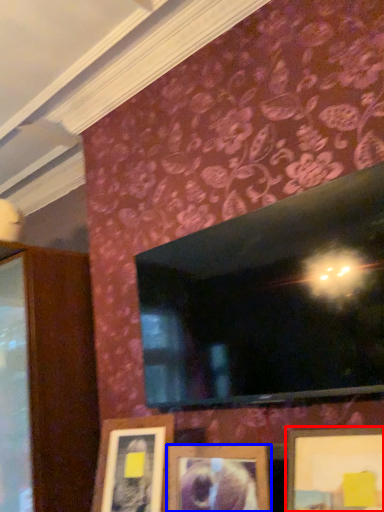
Question: Which object appears closest to the camera in this image, picture frame (highlighted by a red box) or picture frame (highlighted by a blue box)?

Choices:
 (A) picture frame
 (B) picture frame

Answer: (A)